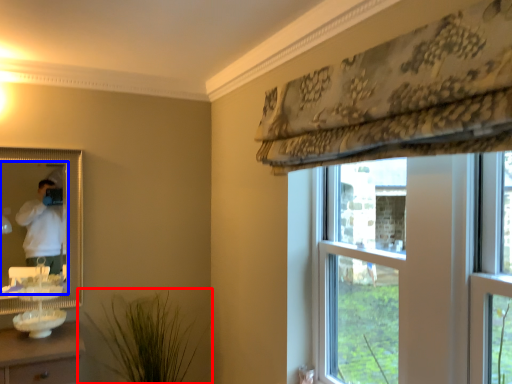
Question: Which object appears closest to the camera in this image, houseplant (highlighted by a red box) or mirror (highlighted by a blue box)?

Choices:
 (A) houseplant
 (B) mirror

Answer: (A)